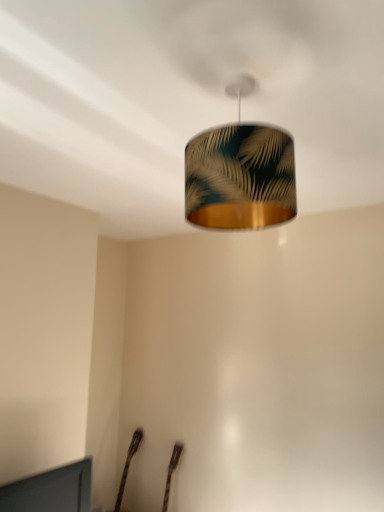
What is the approximate width of gold metallic lampshade at upper center?

It is 31.02 centimeters.

What is the approximate height of gold metallic lampshade at upper center?

It is 15.90 inches.

Describe the element at coordinates (240, 172) in the screenshot. Image resolution: width=384 pixels, height=512 pixels. I see `gold metallic lampshade at upper center` at that location.

I want to click on gold metallic lampshade at upper center, so click(x=240, y=172).

In order to face gold metallic lampshade at upper center, should I rotate leftwards or rightwards?

Rotate your view right by about 6.571°.

The height and width of the screenshot is (512, 384). Identify the location of gold metallic lampshade at upper center. (240, 172).